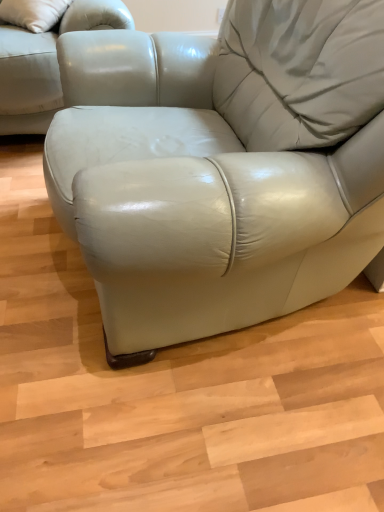
Question: Should I look upward or downward to see matte leather armchair at center?

Choices:
 (A) down
 (B) up

Answer: (B)

Question: Can you confirm if matte leather armchair at center is shorter than matte leather couch at upper left?

Choices:
 (A) yes
 (B) no

Answer: (A)

Question: Is matte leather armchair at center surrounding matte leather couch at upper left?

Choices:
 (A) no
 (B) yes

Answer: (A)

Question: Can you confirm if matte leather armchair at center is positioned to the left of matte leather couch at upper left?

Choices:
 (A) yes
 (B) no

Answer: (B)

Question: Is matte leather armchair at center outside matte leather couch at upper left?

Choices:
 (A) no
 (B) yes

Answer: (B)

Question: Is the surface of matte leather armchair at center in direct contact with matte leather couch at upper left?

Choices:
 (A) yes
 (B) no

Answer: (B)

Question: Is matte leather armchair at center smaller than matte leather couch at upper left?

Choices:
 (A) yes
 (B) no

Answer: (B)

Question: Can you confirm if matte leather couch at upper left is shorter than matte leather armchair at center?

Choices:
 (A) yes
 (B) no

Answer: (B)

Question: Is matte leather couch at upper left with matte leather armchair at center?

Choices:
 (A) yes
 (B) no

Answer: (B)

Question: Is matte leather couch at upper left turned away from matte leather armchair at center?

Choices:
 (A) yes
 (B) no

Answer: (B)

Question: Does matte leather couch at upper left have a larger size compared to matte leather armchair at center?

Choices:
 (A) no
 (B) yes

Answer: (A)

Question: Is matte leather couch at upper left positioned before matte leather armchair at center?

Choices:
 (A) yes
 (B) no

Answer: (B)

Question: Considering the relative positions of matte leather couch at upper left and matte leather armchair at center in the image provided, is matte leather couch at upper left to the left of matte leather armchair at center from the viewer's perspective?

Choices:
 (A) yes
 (B) no

Answer: (A)

Question: Based on their sizes in the image, would you say matte leather couch at upper left is bigger or smaller than matte leather armchair at center?

Choices:
 (A) small
 (B) big

Answer: (A)